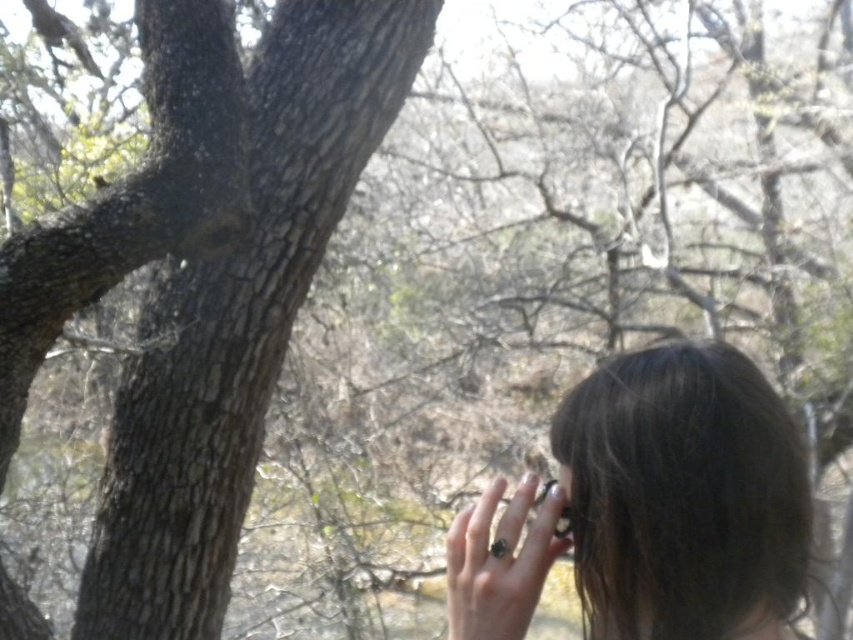
You are a photographer trying to capture a closeup of the dark brown hair at center and the black polished ring at center. Which object is positioned lower in the frame?

The dark brown hair at center is located below the black polished ring at center, so the dark brown hair at center is positioned lower in the frame.

You are an artist sketching the scene and want to ensure proportions are accurate. Which object in the image has a greater width when comparing the dark brown hair at center and the black glossy ring at lower right?

The dark brown hair at center has a greater width than the black glossy ring at lower right.